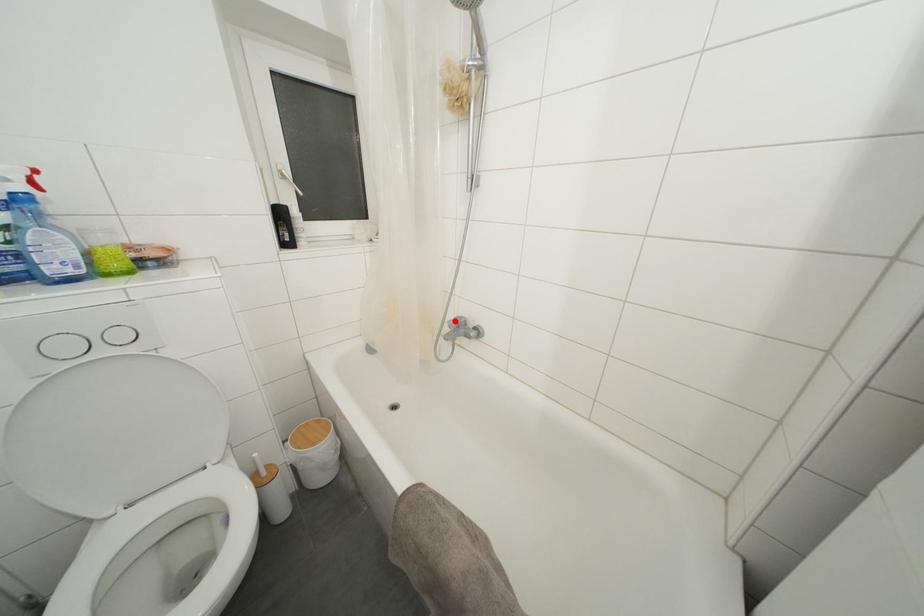
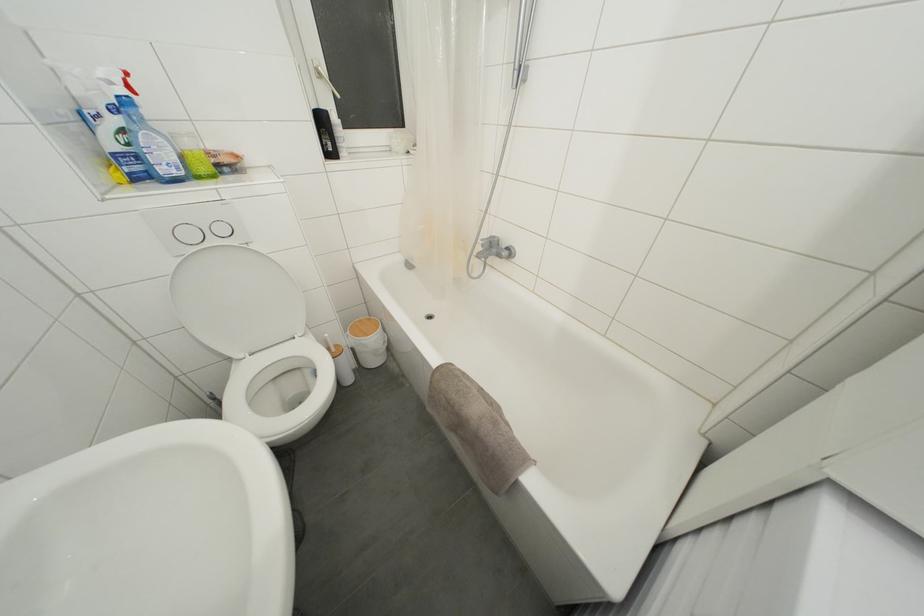
Locate, in the second image, the point that corresponds to the highlighted location in the first image.

(488, 240)